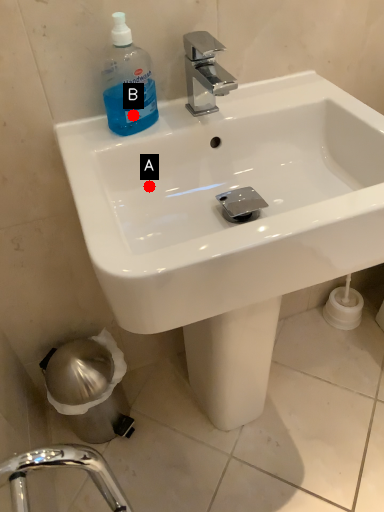
Question: Two points are circled on the image, labeled by A and B beside each circle. Which point is farther to the camera?

Choices:
 (A) A is further
 (B) B is further

Answer: (A)